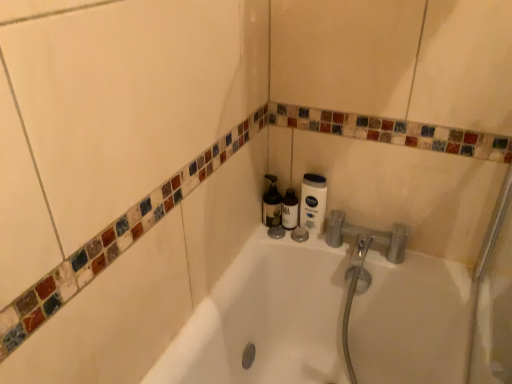
Question: Considering the positions of point (274, 180) and point (292, 211), is point (274, 180) closer or farther from the camera than point (292, 211)?

Choices:
 (A) farther
 (B) closer

Answer: (A)

Question: Which is correct: translucent plastic bottle at center is inside matte black bottle at center, or outside of it?

Choices:
 (A) inside
 (B) outside

Answer: (B)

Question: Estimate the real-world distances between objects in this image. Which object is closer to the translucent plastic bottle at center?

Choices:
 (A) white matte lotion at upper right
 (B) matte black bottle at center

Answer: (B)

Question: Estimate the real-world distances between objects in this image. Which object is closer to the translucent plastic bottle at center?

Choices:
 (A) white matte lotion at upper right
 (B) matte black bottle at center

Answer: (B)